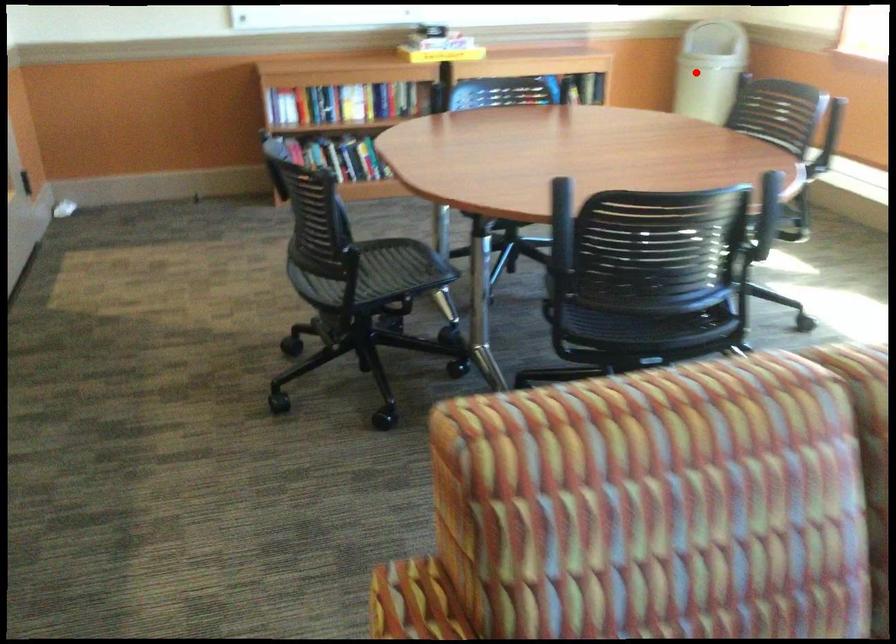
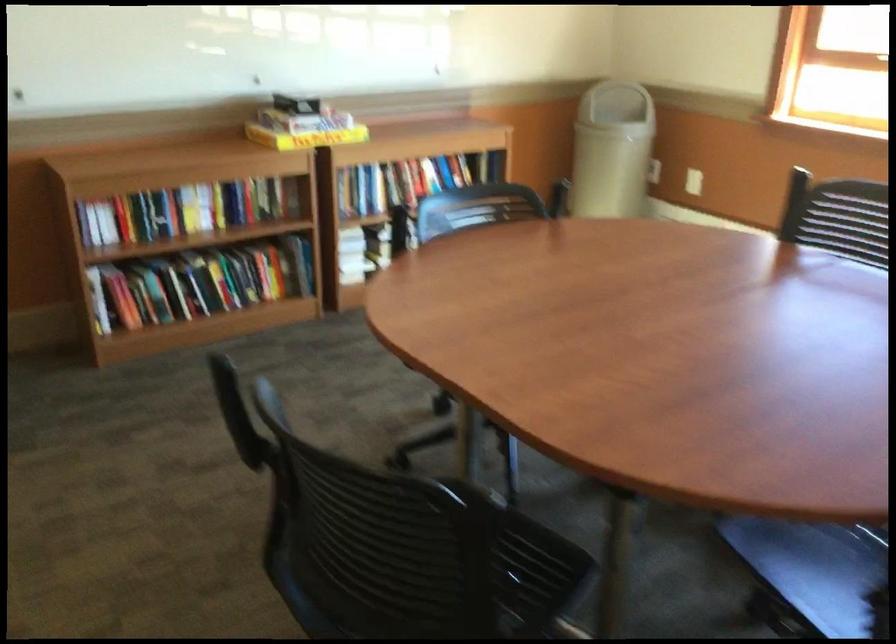
Question: I am providing you with two images of the same scene from different viewpoints. Image1 has a red point marked. In image2, the corresponding 3D location appears at what relative position? Reply with the corresponding letter.

Choices:
 (A) Closer
 (B) Farther

Answer: (A)